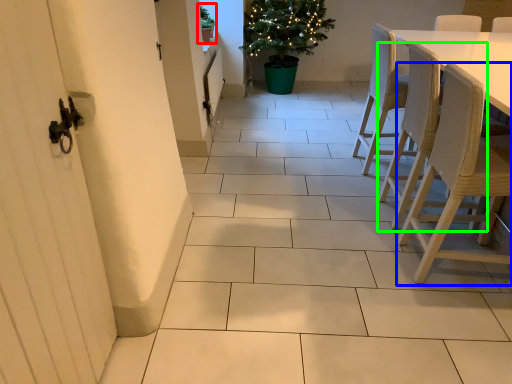
Question: Which is nearer to the houseplant (highlighted by a red box)? chair (highlighted by a blue box) or chair (highlighted by a green box).

Choices:
 (A) chair
 (B) chair

Answer: (B)